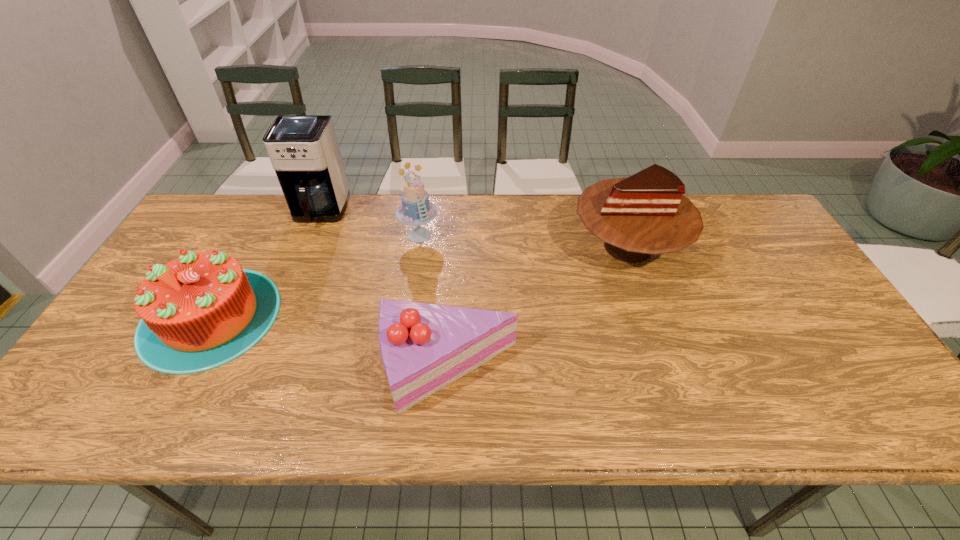
The height and width of the screenshot is (540, 960). Identify the location of object at the left edge. (202, 310).

Image resolution: width=960 pixels, height=540 pixels. In order to click on vacant space at the far edge in this screenshot , I will do `click(368, 194)`.

In the image, there is a desktop. Where is `vacant space at the near edge`? This screenshot has width=960, height=540. vacant space at the near edge is located at coordinates pyautogui.click(x=506, y=401).

Where is `vacant space at the right edge of the desktop`? vacant space at the right edge of the desktop is located at coordinates (836, 343).

Find the location of a particular element. The width and height of the screenshot is (960, 540). vacant space at the far left corner of the desktop is located at coordinates (222, 229).

Image resolution: width=960 pixels, height=540 pixels. What are the coordinates of `vacant region at the near left corner of the desktop` in the screenshot? It's located at (110, 397).

The width and height of the screenshot is (960, 540). In order to click on empty space between the leftmost cake and the shortest cake in this screenshot , I will do `click(329, 342)`.

Identify the location of vacant area between the coffee maker and the leftmost cake. (265, 264).

Where is `blank region between the coffee maker and the shortest object`? The width and height of the screenshot is (960, 540). blank region between the coffee maker and the shortest object is located at coordinates [384, 290].

This screenshot has height=540, width=960. Identify the location of vacant point located between the shortest object and the coffee maker. (384, 290).